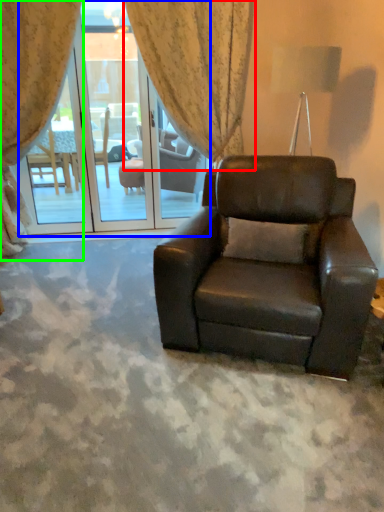
Question: Based on their relative distances, which object is farther from curtain (highlighted by a red box)? Choose from screen door (highlighted by a blue box) and curtain (highlighted by a green box).

Choices:
 (A) screen door
 (B) curtain

Answer: (A)